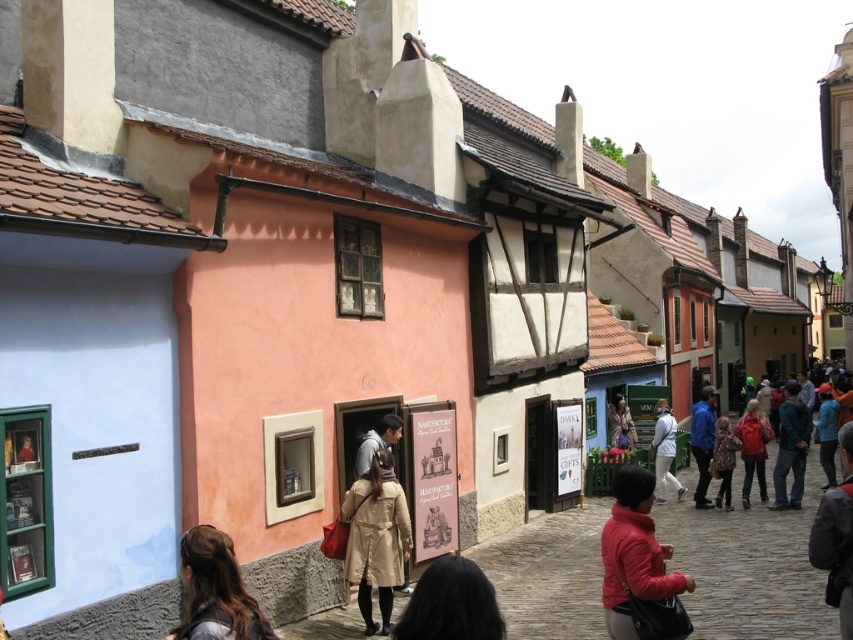
Identify the location of blue denim jacket at lower right. The height and width of the screenshot is (640, 853). (791, 448).

Is blue denim jacket at lower right thinner than blue matte jacket at center?

In fact, blue denim jacket at lower right might be wider than blue matte jacket at center.

Does point (787, 388) come farther from viewer compared to point (715, 406)?

Yes, it is behind point (715, 406).

Where is `blue denim jacket at lower right`? blue denim jacket at lower right is located at coordinates (791, 448).

Who is positioned more to the left, matte red jacket at lower center or brown hair at lower left?

From the viewer's perspective, brown hair at lower left appears more on the left side.

Does matte red jacket at lower center have a smaller size compared to brown hair at lower left?

Yes.

Between point (610, 582) and point (167, 637), which one is positioned behind?

The point (610, 582) is behind.

I want to click on matte red jacket at lower center, so click(634, 554).

Is blue denim jacket at lower right below floral-patterned coat at center?

Yes, blue denim jacket at lower right is below floral-patterned coat at center.

Describe the element at coordinates (791, 448) in the screenshot. I see `blue denim jacket at lower right` at that location.

Locate an element on the screen. blue denim jacket at lower right is located at coordinates (791, 448).